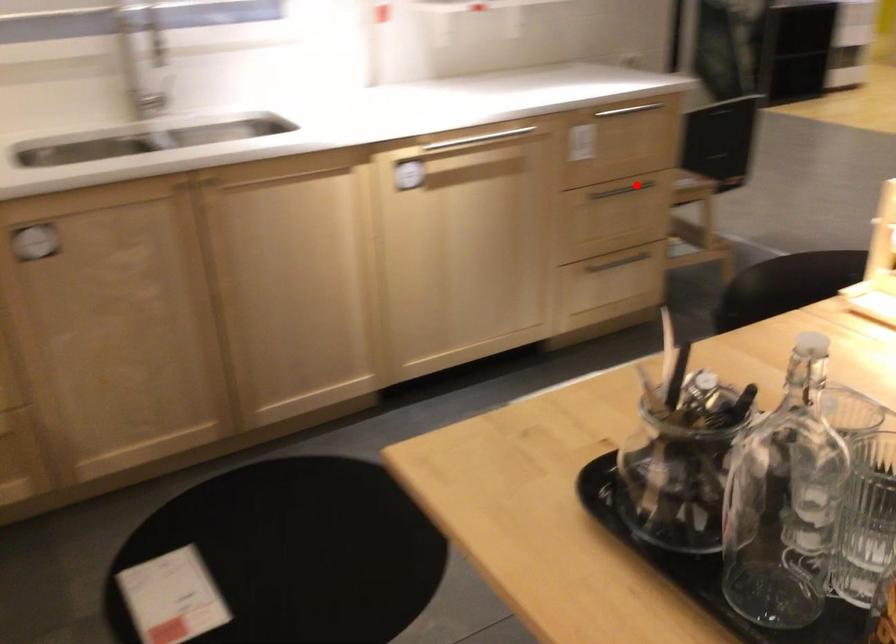
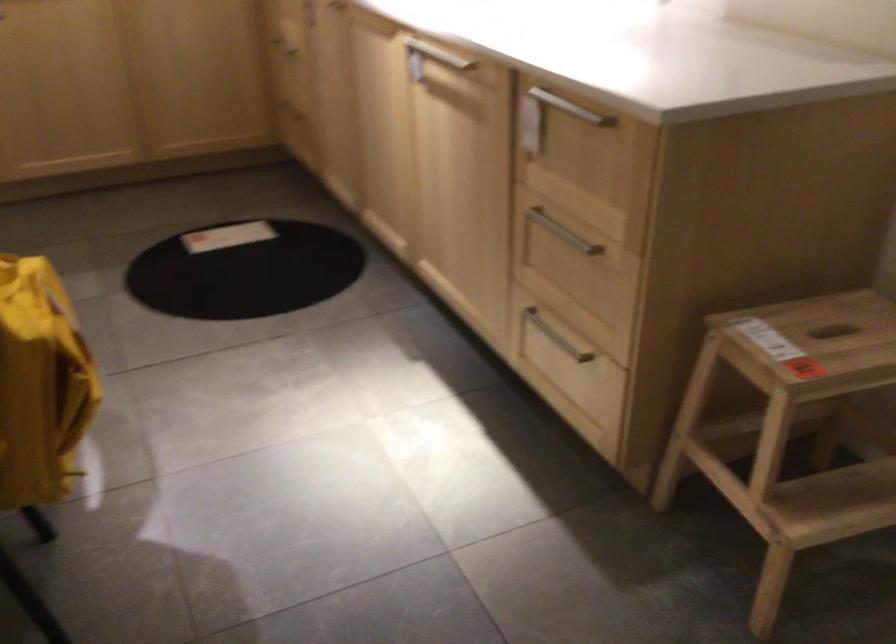
Question: I am providing you with two images of the same scene from different viewpoints. A red point is marked on the first image. At the location where the point appears in image 1, is it still visible in image 2?

Choices:
 (A) Yes
 (B) No

Answer: (A)